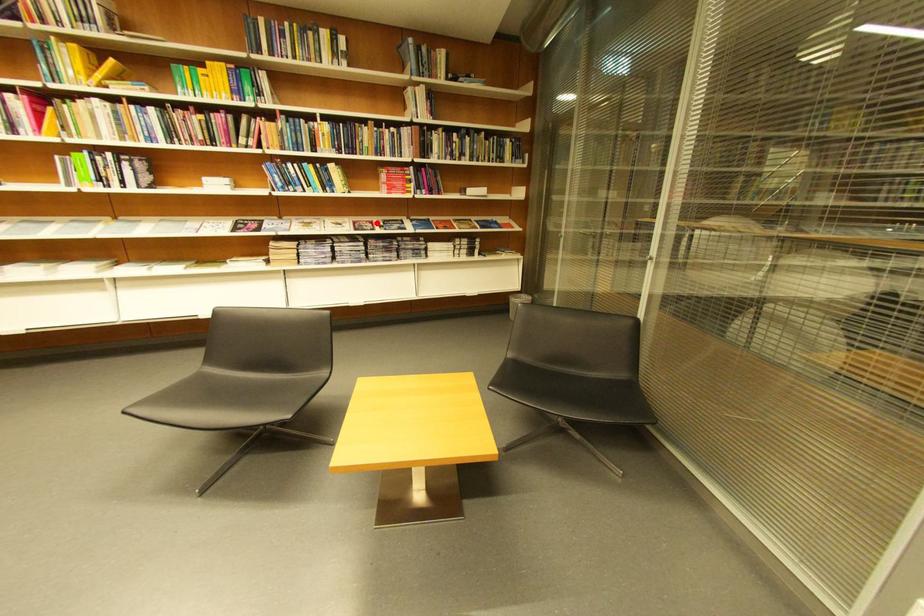
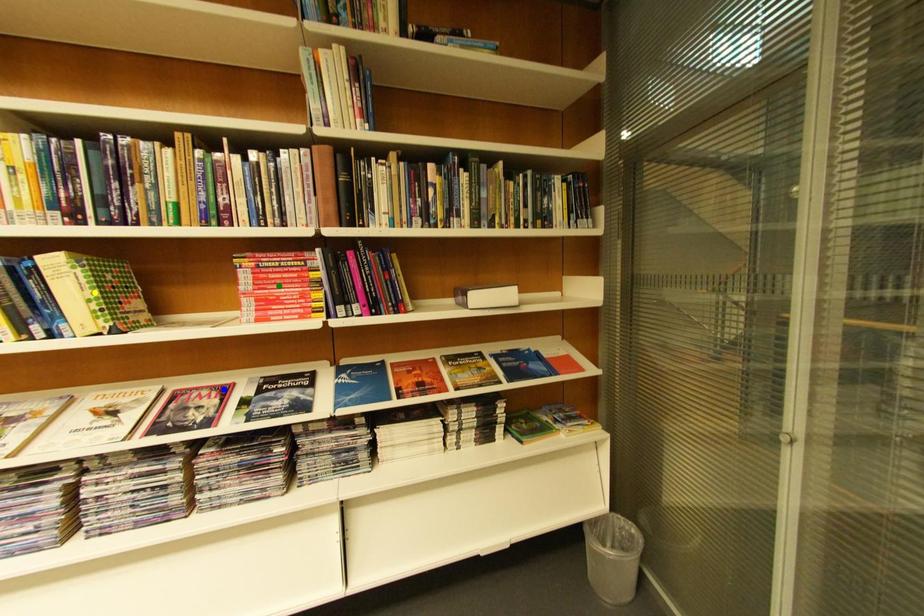
Question: I am providing you with two images of the same scene from different viewpoints. A red point is marked on the first image. You are given multiple points on the second image. Which spot in image 2 lines up with the point in image 1?

Choices:
 (A) green point
 (B) yellow point
 (C) blue point

Answer: (C)